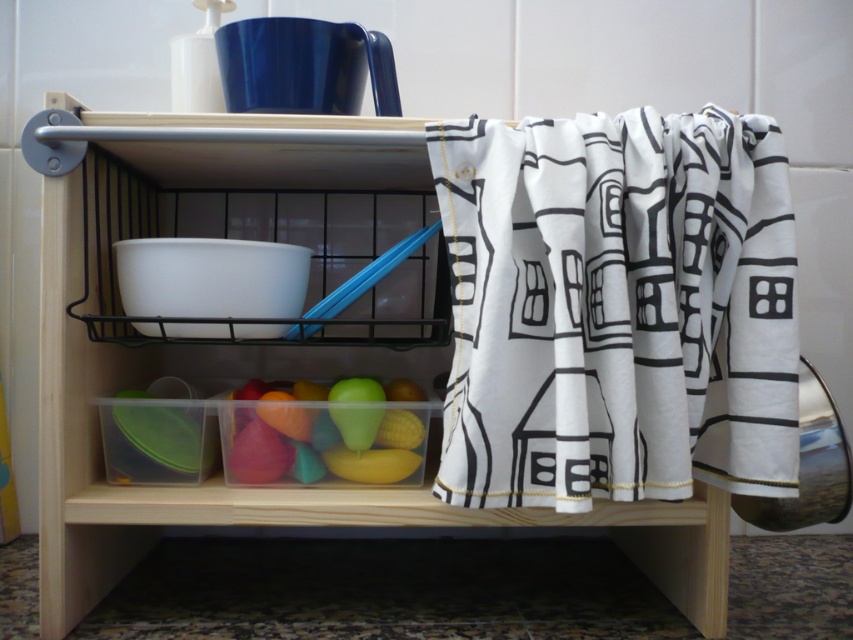
Does point (653, 401) lie behind point (305, 186)?

No, it is in front of (305, 186).

Can you confirm if white fabric at right is wider than transparent plastic container at lower center?

No, white fabric at right is not wider than transparent plastic container at lower center.

Is point (625, 212) farther from viewer compared to point (70, 172)?

No, (625, 212) is in front of (70, 172).

I want to click on white fabric at right, so click(x=618, y=308).